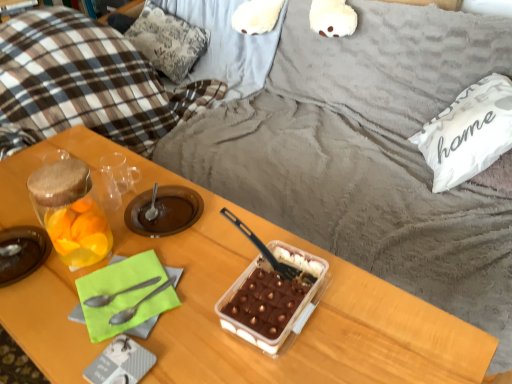
Locate an element on the screen. This screenshot has width=512, height=384. free spot to the right of metallic silver spoon at lower left, acting as the first spoon starting from the left is located at coordinates coord(199,289).